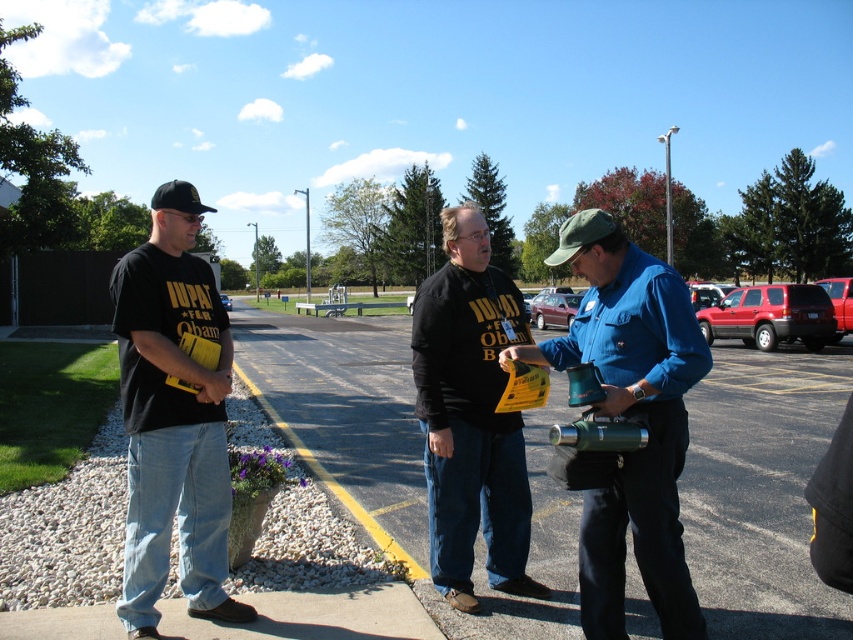
Does asphalt pavement at center lie behind black matte t-shirt at left?

Yes, it is behind black matte t-shirt at left.

Does point (351, 355) come farther from viewer compared to point (219, 317)?

Yes.

Where is `asphalt pavement at center`? This screenshot has height=640, width=853. asphalt pavement at center is located at coordinates (761, 492).

Looking at this image, is asphalt pavement at center positioned behind metallic green canister at center?

Yes, asphalt pavement at center is further from the viewer.

Is point (550, 396) positioned after point (674, 484)?

That is True.

You are a GUI agent. You are given a task and a screenshot of the screen. Output one action in this format:
    pyautogui.click(x=<x>, y=<y>)
    Task: Click on the asphalt pavement at center
    
    Given the screenshot: What is the action you would take?
    pyautogui.click(x=761, y=492)

Does asphalt pavement at center have a greater height compared to black matte shirt at center?

Incorrect, asphalt pavement at center's height is not larger of black matte shirt at center's.

Between asphalt pavement at center and black matte shirt at center, which one has more height?

black matte shirt at center is taller.

This screenshot has width=853, height=640. What do you see at coordinates (761, 492) in the screenshot?
I see `asphalt pavement at center` at bounding box center [761, 492].

Where is `asphalt pavement at center`? The width and height of the screenshot is (853, 640). asphalt pavement at center is located at coordinates (761, 492).